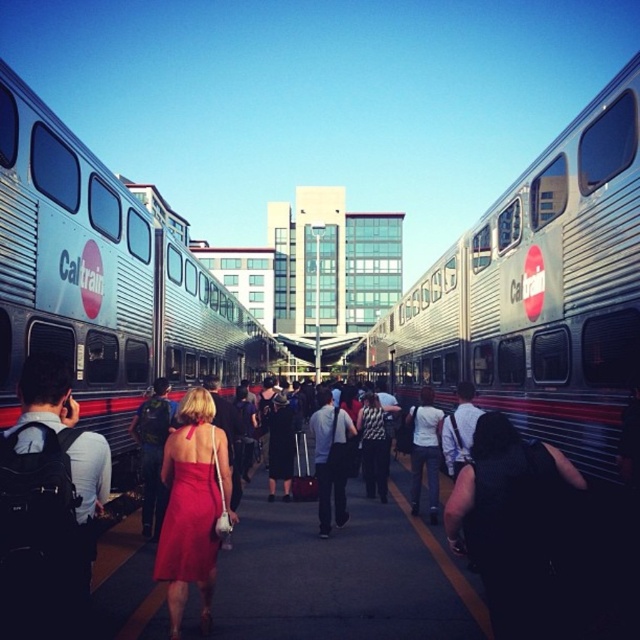
Question: Among these objects, which one is nearest to the camera?

Choices:
 (A) silver metallic train at center
 (B) silver metallic train at left
 (C) matte red dress at center
 (D) dark gray pants at center

Answer: (B)

Question: Does dark gray pants at center appear on the left side of white shirt at center?

Choices:
 (A) no
 (B) yes

Answer: (B)

Question: Is silver metallic train at left wider than matte red dress at center?

Choices:
 (A) yes
 (B) no

Answer: (A)

Question: Which point is closer to the camera?

Choices:
 (A) silver metallic train at center
 (B) white shirt at center

Answer: (A)

Question: Can you confirm if silver metallic train at center is positioned to the left of dark gray pants at center?

Choices:
 (A) yes
 (B) no

Answer: (B)

Question: Which of the following is the closest to the observer?

Choices:
 (A) matte red dress at center
 (B) dark gray pants at center
 (C) white shirt at center

Answer: (A)